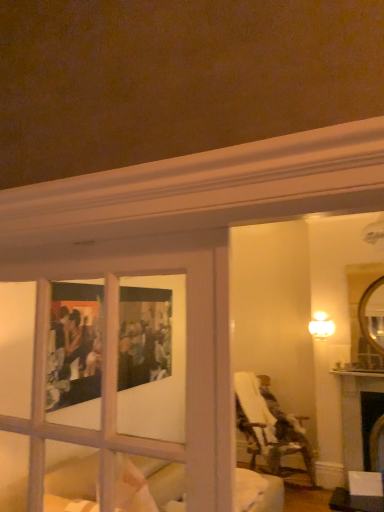
Question: Is point (248, 411) positioned closer to the camera than point (314, 315)?

Choices:
 (A) farther
 (B) closer

Answer: (B)

Question: Which is correct: plaid fabric chair at right is inside white glossy light fixture at upper right, or outside of it?

Choices:
 (A) inside
 (B) outside

Answer: (B)

Question: Is plaid fabric chair at right wider or thinner than white glossy light fixture at upper right?

Choices:
 (A) thin
 (B) wide

Answer: (B)

Question: Relative to plaid fabric chair at right, is white glossy light fixture at upper right in front or behind?

Choices:
 (A) front
 (B) behind

Answer: (B)

Question: Is point pos(331,321) positioned closer to the camera than point pos(299,432)?

Choices:
 (A) closer
 (B) farther

Answer: (B)

Question: Is white glossy light fixture at upper right situated inside plaid fabric chair at right or outside?

Choices:
 (A) inside
 (B) outside

Answer: (B)

Question: In terms of height, does white glossy light fixture at upper right look taller or shorter compared to plaid fabric chair at right?

Choices:
 (A) tall
 (B) short

Answer: (B)